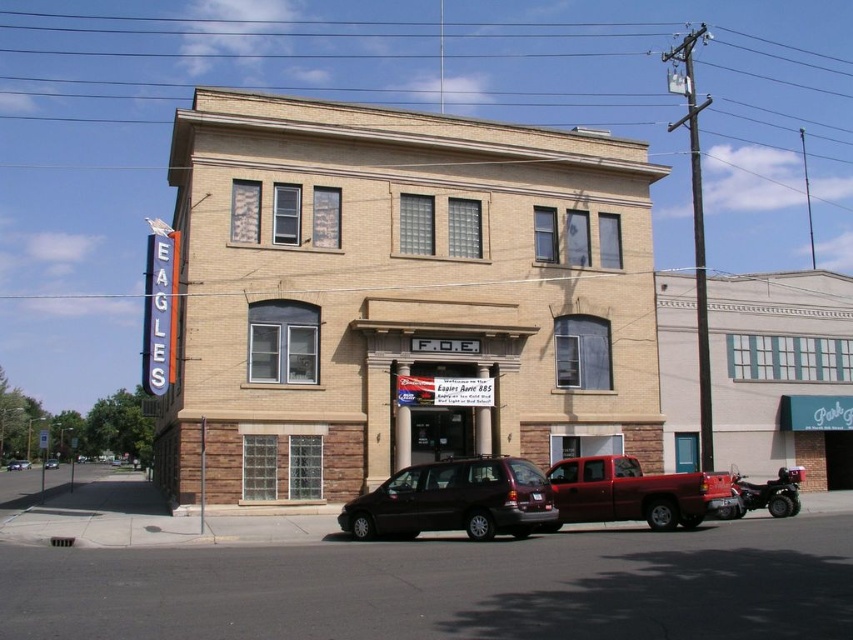
Question: Based on their relative distances, which object is farther from the metallic red truck at center?

Choices:
 (A) shiny black van at center
 (B) matte black minivan at center

Answer: (A)

Question: Which object appears closest to the camera in this image?

Choices:
 (A) matte black minivan at center
 (B) metallic red truck at center

Answer: (A)

Question: Can you confirm if metallic red truck at center is smaller than shiny black van at center?

Choices:
 (A) no
 (B) yes

Answer: (B)

Question: Is matte black minivan at center positioned behind metallic red truck at center?

Choices:
 (A) no
 (B) yes

Answer: (A)

Question: Which object is positioned farthest from the matte black minivan at center?

Choices:
 (A) shiny black van at center
 (B) metallic red truck at center

Answer: (A)

Question: Where is matte black minivan at center located in relation to metallic red truck at center in the image?

Choices:
 (A) above
 (B) below

Answer: (A)